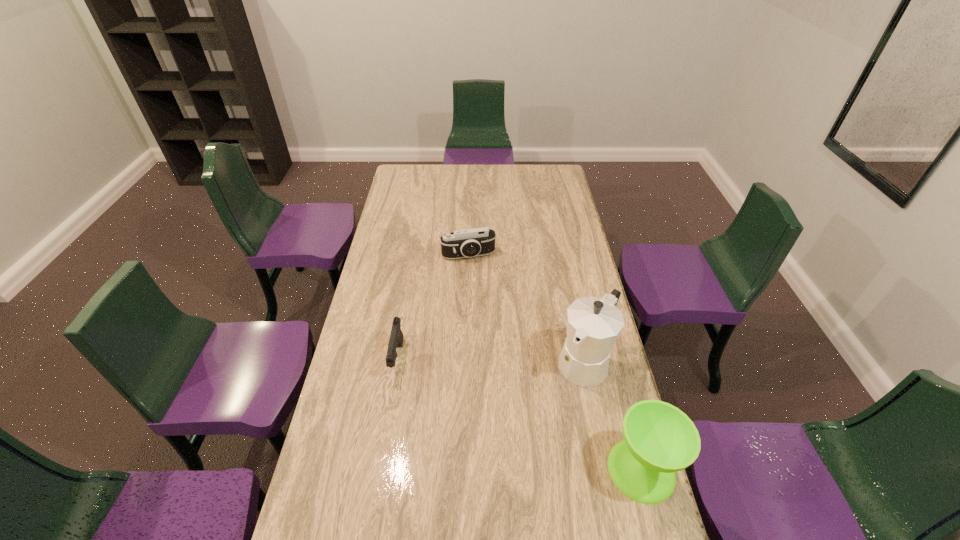
The image size is (960, 540). What are the coordinates of `free space between the third object from right to left and the pistol` in the screenshot? It's located at (433, 307).

At what (x,y) coordinates should I click in order to perform the action: click on object that is the third closest to the third object from right to left. Please return your answer as a coordinate pair (x, y). The width and height of the screenshot is (960, 540). Looking at the image, I should click on (659, 439).

The width and height of the screenshot is (960, 540). Identify the location of the closest object to the tallest object. (659, 439).

I want to click on free location that satisfies the following two spatial constraints: 1. at the barrel of the leftmost object; 2. on the left side of the wineglass, so click(x=379, y=470).

Where is `free space that satisfies the following two spatial constraints: 1. on the front side of the wineglass; 2. on the left side of the farthest object`? free space that satisfies the following two spatial constraints: 1. on the front side of the wineglass; 2. on the left side of the farthest object is located at coordinates (463, 470).

Where is `free space that satisfies the following two spatial constraints: 1. at the barrel of the tallest object; 2. on the right side of the leftmost object`? This screenshot has height=540, width=960. free space that satisfies the following two spatial constraints: 1. at the barrel of the tallest object; 2. on the right side of the leftmost object is located at coordinates (397, 361).

What are the coordinates of `free space that satisfies the following two spatial constraints: 1. on the front side of the second object from left to right; 2. on the left side of the nearest object` in the screenshot? It's located at (463, 470).

Locate an element on the screen. This screenshot has width=960, height=540. free point that satisfies the following two spatial constraints: 1. on the front side of the coffeepot; 2. on the left side of the camera is located at coordinates [466, 361].